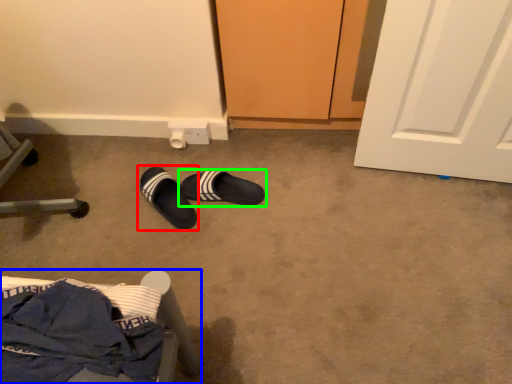
Question: Considering the real-world distances, which object is closest to footwear (highlighted by a red box)? furniture (highlighted by a blue box) or footwear (highlighted by a green box).

Choices:
 (A) furniture
 (B) footwear

Answer: (B)